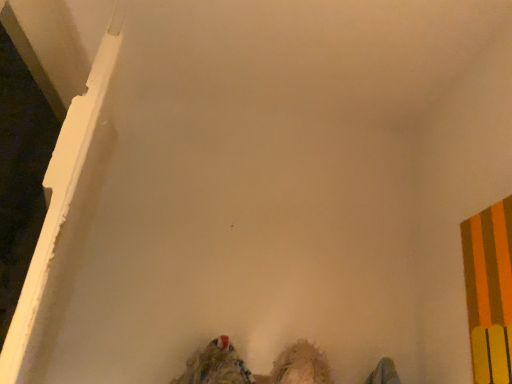
What is the approximate height of white painted wood at left?

white painted wood at left is 24.00 inches in height.

Describe the element at coordinates (59, 207) in the screenshot. I see `white painted wood at left` at that location.

Find the location of a particular element. This screenshot has width=512, height=384. white painted wood at left is located at coordinates (59, 207).

What is the approximate width of white painted wood at left?

1.95 inches.

At what (x,y) coordinates should I click in order to perform the action: click on white painted wood at left. Please return your answer as a coordinate pair (x, y). Looking at the image, I should click on (59, 207).